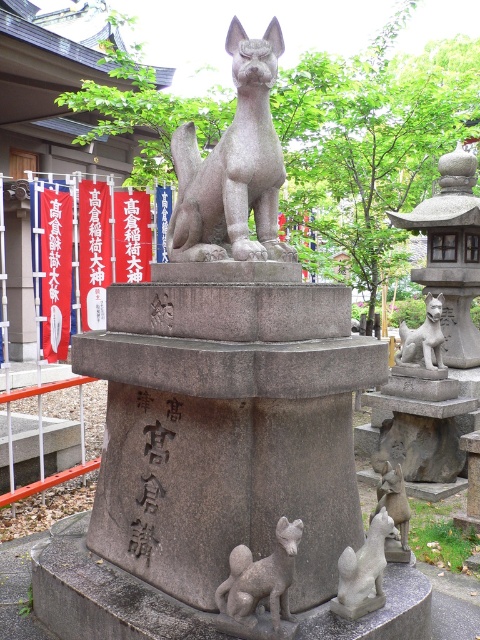
Find the location of `stone lantern at center`. stone lantern at center is located at coordinates (451, 252).

Does point (445, 172) come behind point (405, 522)?

Yes, point (445, 172) is behind point (405, 522).

Image resolution: width=480 pixels, height=640 pixels. What are the coordinates of `stone lantern at center` in the screenshot? It's located at (451, 252).

Is gray stone pedestal at center to the right of gray stone fox at lower center from the viewer's perspective?

Incorrect, gray stone pedestal at center is not on the right side of gray stone fox at lower center.

At what (x,y) coordinates should I click in order to perform the action: click on gray stone pedestal at center. Please return your answer as a coordinate pair (x, y). This screenshot has height=640, width=480. Looking at the image, I should click on (227, 422).

Is point (194, 332) closer to viewer compared to point (232, 634)?

No, (194, 332) is behind (232, 634).

The width and height of the screenshot is (480, 640). Identify the location of gray stone pedestal at center. (227, 422).

Does gray stone pedestal at center appear on the left side of gray stone fox at center?

Correct, you'll find gray stone pedestal at center to the left of gray stone fox at center.

Is gray stone pedestal at center thinner than gray stone fox at center?

No, gray stone pedestal at center is not thinner than gray stone fox at center.

Is point (197, 589) closer to viewer compared to point (395, 481)?

Yes.

Locate an element on the screen. The image size is (480, 640). gray stone pedestal at center is located at coordinates (227, 422).